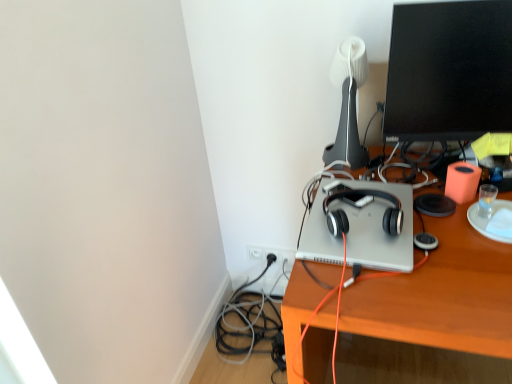
Where is `vacant area to the right of silver metallic laptop at center`? Image resolution: width=512 pixels, height=384 pixels. vacant area to the right of silver metallic laptop at center is located at coordinates (442, 215).